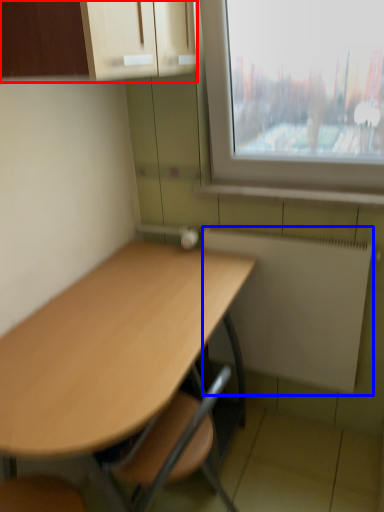
Question: Which object appears closest to the camera in this image, cabinetry (highlighted by a red box) or radiator (highlighted by a blue box)?

Choices:
 (A) cabinetry
 (B) radiator

Answer: (A)